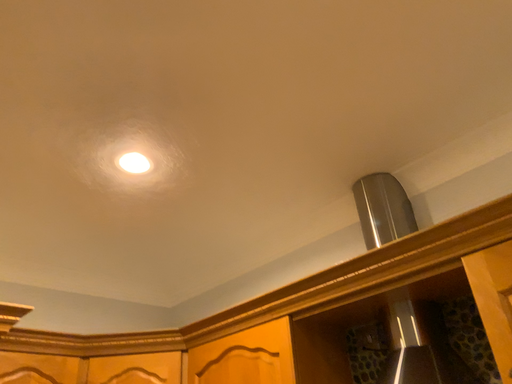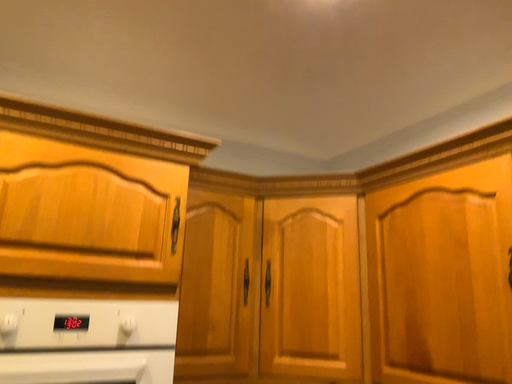
Question: How did the camera likely rotate when shooting the video?

Choices:
 (A) rotated left
 (B) rotated right

Answer: (A)